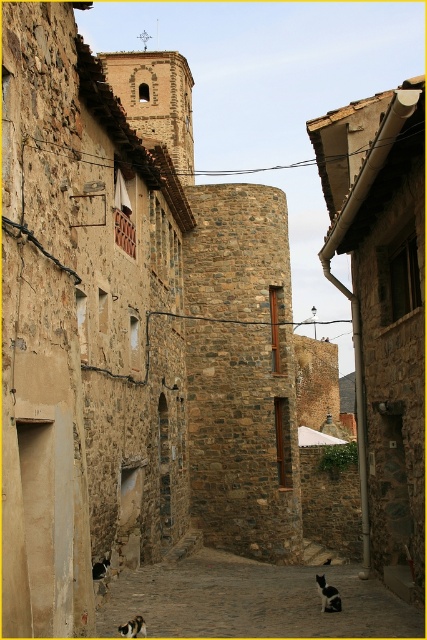
You are standing at the entrance of the historic village and see the brown stone alley at center and the calico fur cat at lower center. Which object is closer to you?

The calico fur cat at lower center is closer because it is positioned above the brown stone alley at center.

You are a tourist standing on the cobblestone street and want to take a photo of the brown stone alley at center and the calico fur cat at lower center. Which object should you focus on first to ensure both are in the frame?

You should focus on the calico fur cat at lower center first because it is farther away from you than the brown stone alley at center, allowing both to be in the frame when focused on the farther object.

You are a tourist standing at the starting point of the cobblestone street. You notice two points marked on the path ahead. The first point is at coordinate point(x=321, y=589) and the second is at point(x=129, y=628). If you walk straight ahead, which point will you encounter first?

Point(x=129, y=628) will be encountered first because it is in front of point(x=321, y=589) according to the spatial arrangement.